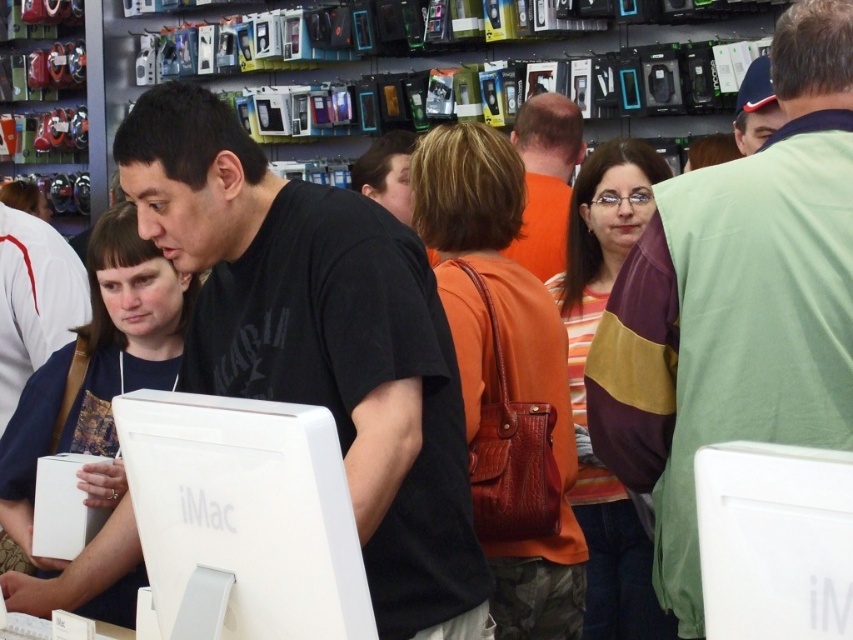
Can you confirm if black matte shirt at center is positioned to the left of white matte imac at center?

Indeed, black matte shirt at center is positioned on the left side of white matte imac at center.

Is black matte shirt at center smaller than white matte imac at center?

No.

Is point (171, 138) more distant than point (741, 481)?

Yes, point (171, 138) is farther from viewer.

Image resolution: width=853 pixels, height=640 pixels. What are the coordinates of `black matte shirt at center` in the screenshot? It's located at (320, 340).

Is white glossy imac at center further to camera compared to blue fabric cap at upper right?

No, white glossy imac at center is in front of blue fabric cap at upper right.

Who is more distant from viewer, (216, 524) or (767, 58)?

The point (767, 58) is behind.

Identify the location of white glossy imac at center. (242, 516).

Does brown leather purse at center come behind orange fabric shirt at center?

No, brown leather purse at center is in front of orange fabric shirt at center.

Which is in front, point (436, 284) or point (561, 160)?

Point (436, 284) is more forward.

Is point (572, 609) more distant than point (543, 269)?

No, (572, 609) is in front of (543, 269).

You are a GUI agent. You are given a task and a screenshot of the screen. Output one action in this format:
    pyautogui.click(x=<x>, y=<y>)
    Task: Click on the brown leather purse at center
    This screenshot has height=640, width=853.
    Given the screenshot: What is the action you would take?
    pyautogui.click(x=503, y=376)